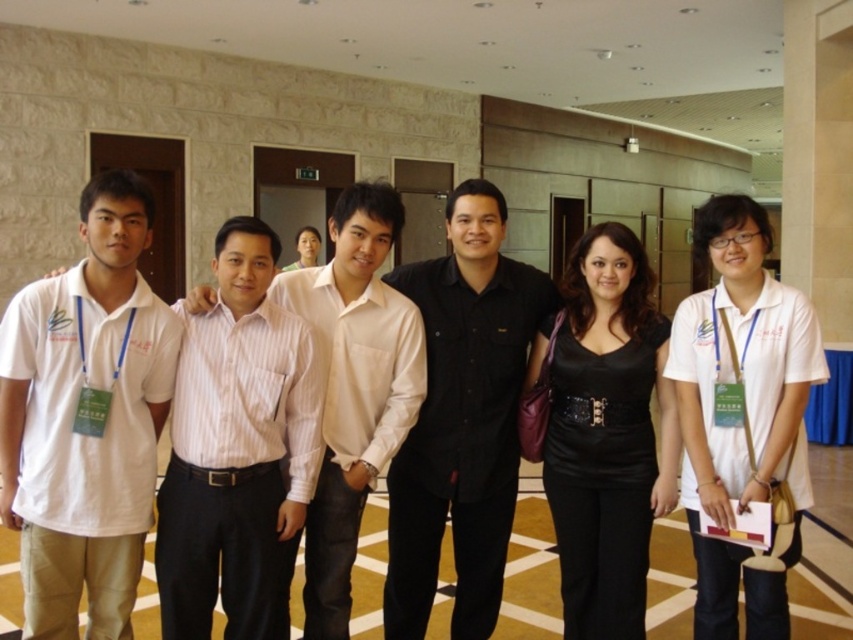
Between black matte shirt at center and matte black dress at center, which one appears on the right side from the viewer's perspective?

Positioned to the right is black matte shirt at center.

Which is behind, point (437, 388) or point (303, 234)?

The point (303, 234) is behind.

What do you see at coordinates (462, 419) in the screenshot?
I see `black matte shirt at center` at bounding box center [462, 419].

Find the location of a particular element. This screenshot has width=853, height=640. black matte shirt at center is located at coordinates (462, 419).

Does black leather dress at center appear under matte black dress at center?

Correct, black leather dress at center is located below matte black dress at center.

Can you confirm if black leather dress at center is positioned to the left of matte black dress at center?

No, black leather dress at center is not to the left of matte black dress at center.

Who is more forward, [606,496] or [306,244]?

Point [606,496] is in front.

You are a GUI agent. You are given a task and a screenshot of the screen. Output one action in this format:
    pyautogui.click(x=<x>, y=<y>)
    Task: Click on the black leather dress at center
    The height and width of the screenshot is (640, 853).
    Given the screenshot: What is the action you would take?
    pyautogui.click(x=607, y=435)

At what (x,y) coordinates should I click in order to perform the action: click on white cotton shirt at center. Please return your answer as a coordinate pair (x, y). The width and height of the screenshot is (853, 640). Looking at the image, I should click on (741, 410).

I want to click on white cotton shirt at center, so click(741, 410).

Locate an element on the screen. white cotton shirt at center is located at coordinates (741, 410).